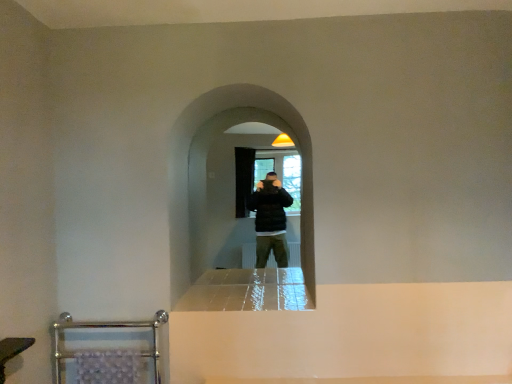
Question: Is chrome metallic towel rack at lower left bigger than black matte screen door at center?

Choices:
 (A) no
 (B) yes

Answer: (A)

Question: Considering the relative sizes of chrome metallic towel rack at lower left and black matte screen door at center in the image provided, is chrome metallic towel rack at lower left wider than black matte screen door at center?

Choices:
 (A) no
 (B) yes

Answer: (A)

Question: Is chrome metallic towel rack at lower left closer to camera compared to black matte screen door at center?

Choices:
 (A) yes
 (B) no

Answer: (A)

Question: From the image's perspective, is chrome metallic towel rack at lower left located beneath black matte screen door at center?

Choices:
 (A) no
 (B) yes

Answer: (B)

Question: Is chrome metallic towel rack at lower left touching black matte screen door at center?

Choices:
 (A) no
 (B) yes

Answer: (A)

Question: From the image's perspective, is brushed metal towel rack at lower left located above or below chrome metallic towel rack at lower left?

Choices:
 (A) below
 (B) above

Answer: (B)

Question: In terms of height, does brushed metal towel rack at lower left look taller or shorter compared to chrome metallic towel rack at lower left?

Choices:
 (A) tall
 (B) short

Answer: (B)

Question: Is brushed metal towel rack at lower left in front of or behind chrome metallic towel rack at lower left in the image?

Choices:
 (A) front
 (B) behind

Answer: (A)

Question: Is brushed metal towel rack at lower left situated inside chrome metallic towel rack at lower left or outside?

Choices:
 (A) outside
 (B) inside

Answer: (A)

Question: Considering the relative positions of chrome metallic towel rack at lower left and brushed metal towel rack at lower left in the image provided, is chrome metallic towel rack at lower left to the left or to the right of brushed metal towel rack at lower left?

Choices:
 (A) right
 (B) left

Answer: (A)

Question: Would you say chrome metallic towel rack at lower left is inside or outside brushed metal towel rack at lower left?

Choices:
 (A) inside
 (B) outside

Answer: (B)

Question: From the image's perspective, is chrome metallic towel rack at lower left positioned above or below brushed metal towel rack at lower left?

Choices:
 (A) above
 (B) below

Answer: (B)

Question: Considering the positions of chrome metallic towel rack at lower left and brushed metal towel rack at lower left in the image, is chrome metallic towel rack at lower left bigger or smaller than brushed metal towel rack at lower left?

Choices:
 (A) small
 (B) big

Answer: (B)

Question: Is brushed metal towel rack at lower left spatially inside black matte screen door at center, or outside of it?

Choices:
 (A) outside
 (B) inside

Answer: (A)

Question: Considering the positions of brushed metal towel rack at lower left and black matte screen door at center in the image, is brushed metal towel rack at lower left taller or shorter than black matte screen door at center?

Choices:
 (A) short
 (B) tall

Answer: (A)